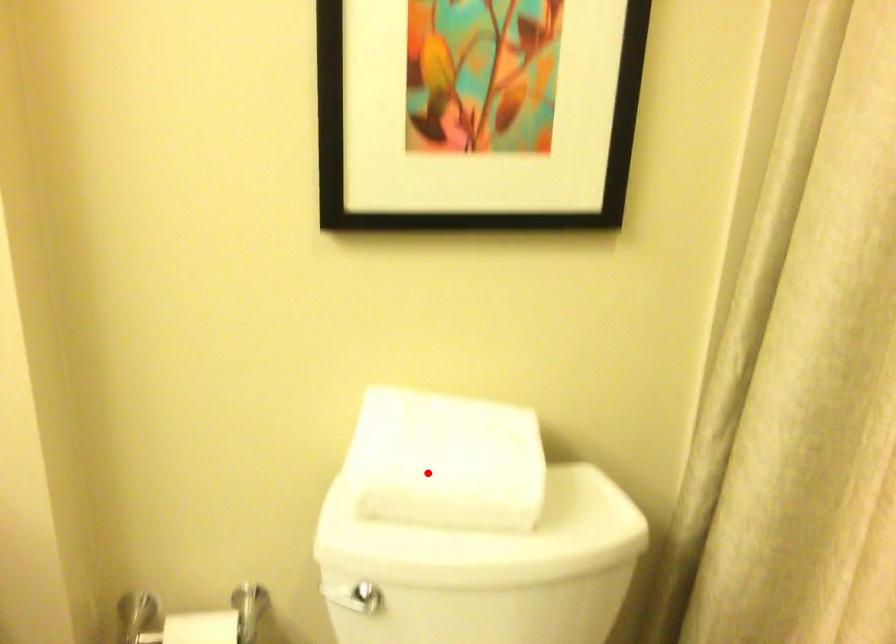
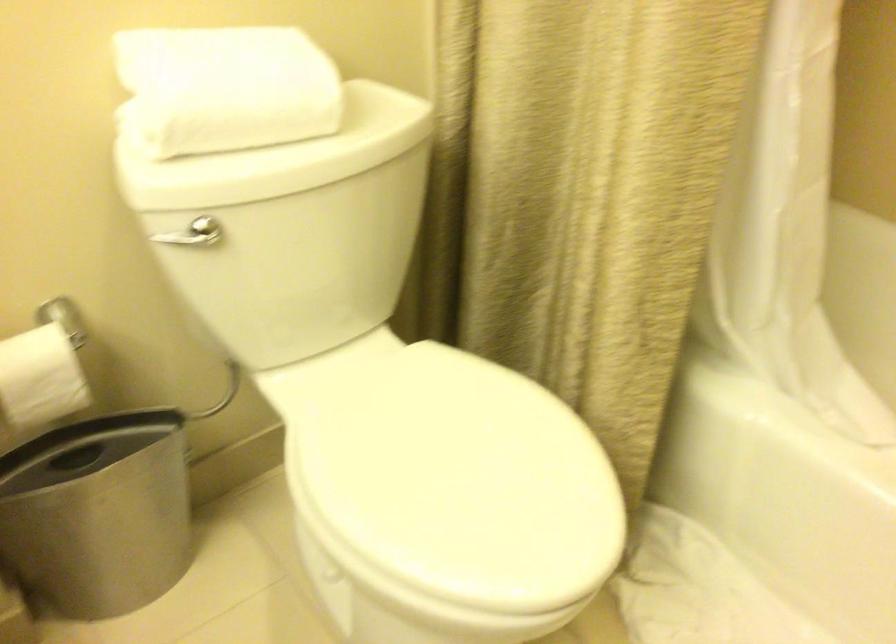
Find the pixel in the second image that matches the highlighted location in the first image.

(225, 88)